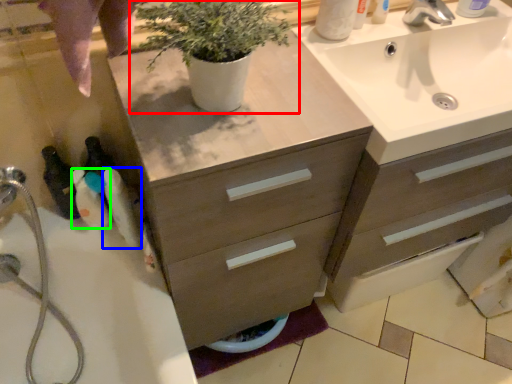
Question: Considering the real-world distances, which object is closest to houseplant (highlighted by a red box)? toiletry (highlighted by a blue box) or toiletry (highlighted by a green box).

Choices:
 (A) toiletry
 (B) toiletry

Answer: (A)